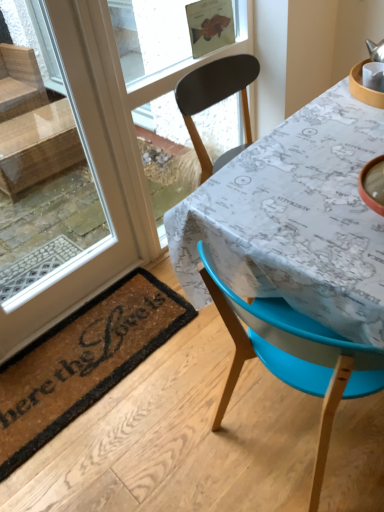
This screenshot has height=512, width=384. Identify the location of free space above brown coir mat at lower left (from a real-world perspective). (81, 354).